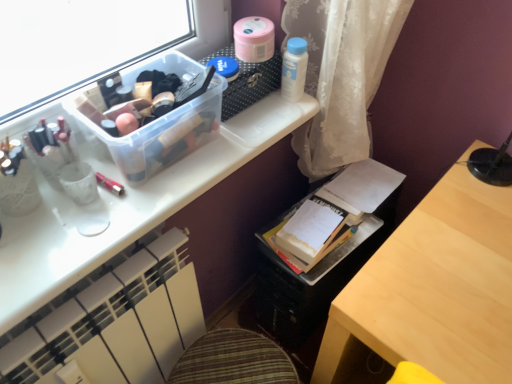
What are the coordinates of `free space that is in between white plastic bottle at upper right, which is the 1th toiletry in top-to-bottom order, and metallic pink pen at upper left, which appears as the first toiletry when viewed from the front` in the screenshot? It's located at (212, 135).